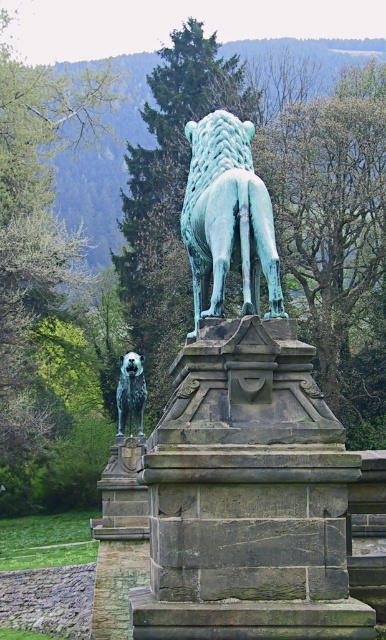
You are an art student analyzing the statues in the image. You notice two statues, the green patina stone lion at center and the shaggy fur dog at center. Based on their positions, which statue is located to the left?

The shaggy fur dog at center is located to the left of the green patina stone lion at center.